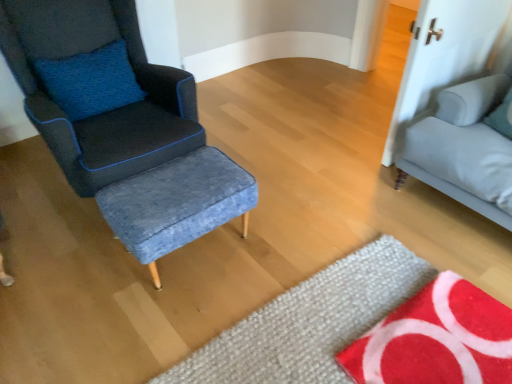
Locate an element on the screen. free spot to the right of denim fabric stool at center is located at coordinates (278, 244).